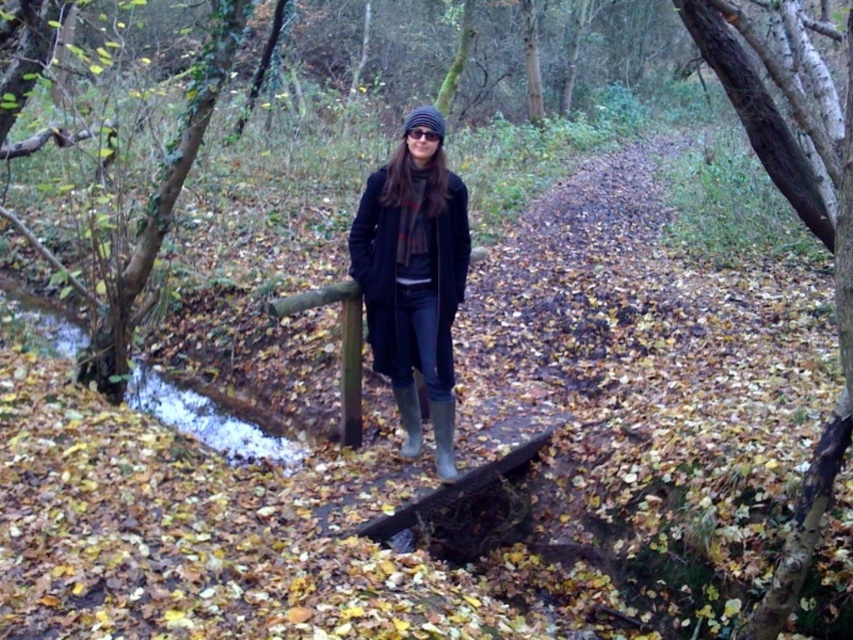
Question: Can you confirm if matte black coat at center is positioned above rubber/matte boot at center?

Choices:
 (A) no
 (B) yes

Answer: (B)

Question: Among these objects, which one is nearest to the camera?

Choices:
 (A) rubber/matte boot at center
 (B) rubber boots at center

Answer: (A)

Question: Is clear water at lower left to the left of rubber boots at center from the viewer's perspective?

Choices:
 (A) no
 (B) yes

Answer: (B)

Question: Is clear water at lower left above rubber/matte boot at center?

Choices:
 (A) no
 (B) yes

Answer: (A)

Question: Among these points, which one is farthest from the camera?

Choices:
 (A) (450, 417)
 (B) (292, 458)
 (C) (450, 426)

Answer: (B)

Question: Which object is farther from the camera taking this photo?

Choices:
 (A) clear water at lower left
 (B) rubber boots at center

Answer: (A)